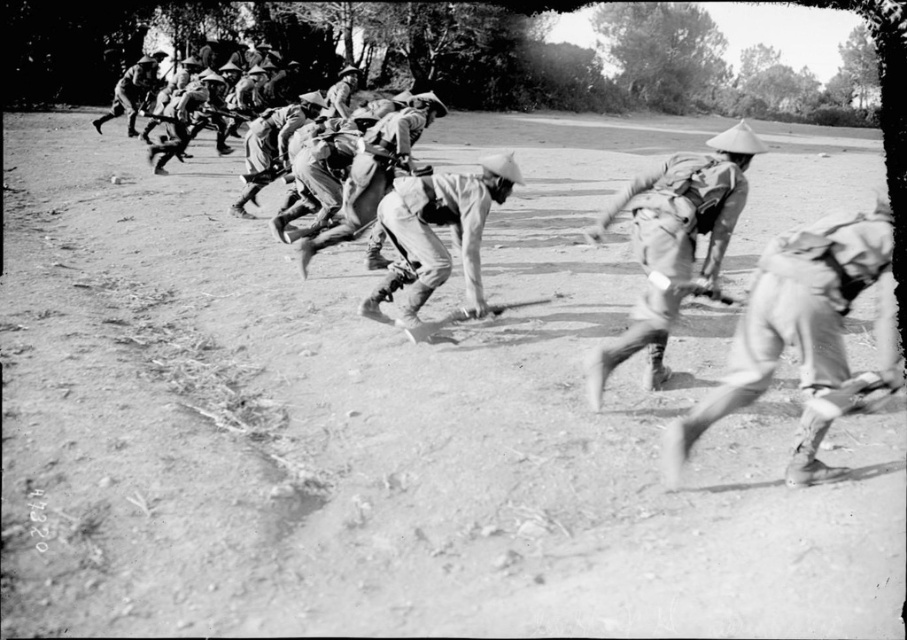
You are a photographer standing at the camera position. You want to capture a closeup shot of the camouflage fabric uniform at center. Given that your camera can focus on objects within 2 meters, will you be able to take the closeup?

The camouflage fabric uniform at center is 3.31 meters away from the camera. Since the camera can only focus on objects within 2 meters, it is too far away to capture a clear closeup.

You are observing a group of soldiers in a training exercise. You notice a light brown uniform at center and a uniformed soldier at center. Which object is closer to the viewer?

The light brown uniform at center is positioned under the uniformed soldier at center, meaning it is closer to the viewer.

You are a photographer trying to capture a photo of the soldiers. You need to ensure that the light gray uniform at center and the rough canvas uniform at center are both clearly visible in the frame. Given their sizes, which uniform should you focus on to ensure it fits within the camera frame first?

The light gray uniform at center is wider than the rough canvas uniform at center, so you should focus on capturing the light gray uniform at center first to ensure it fits within the camera frame.